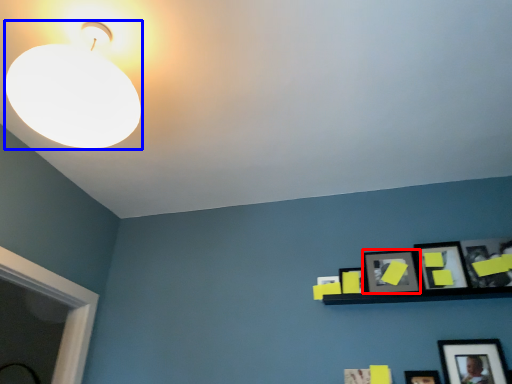
Question: Which object appears farthest to the camera in this image, picture frame (highlighted by a red box) or lamp (highlighted by a blue box)?

Choices:
 (A) picture frame
 (B) lamp

Answer: (A)